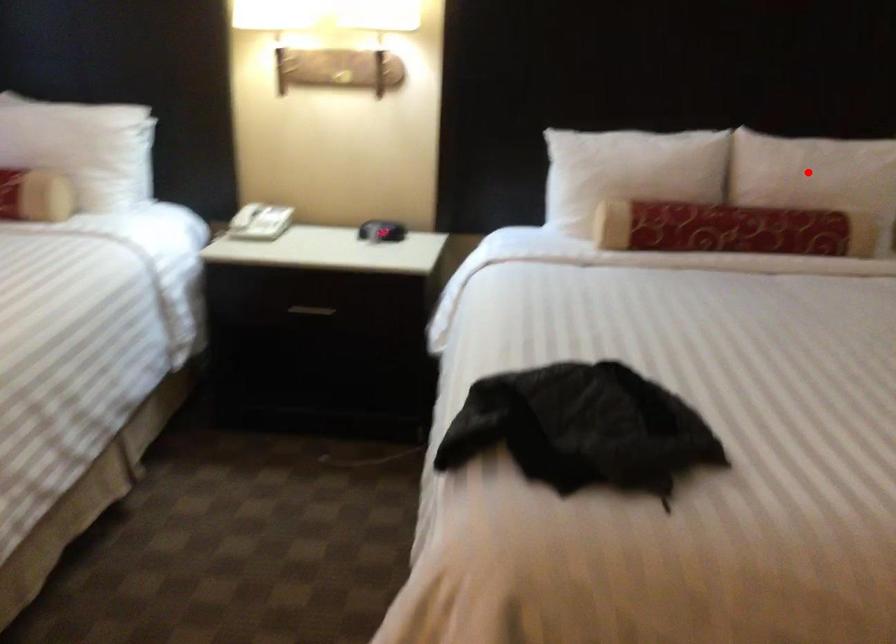
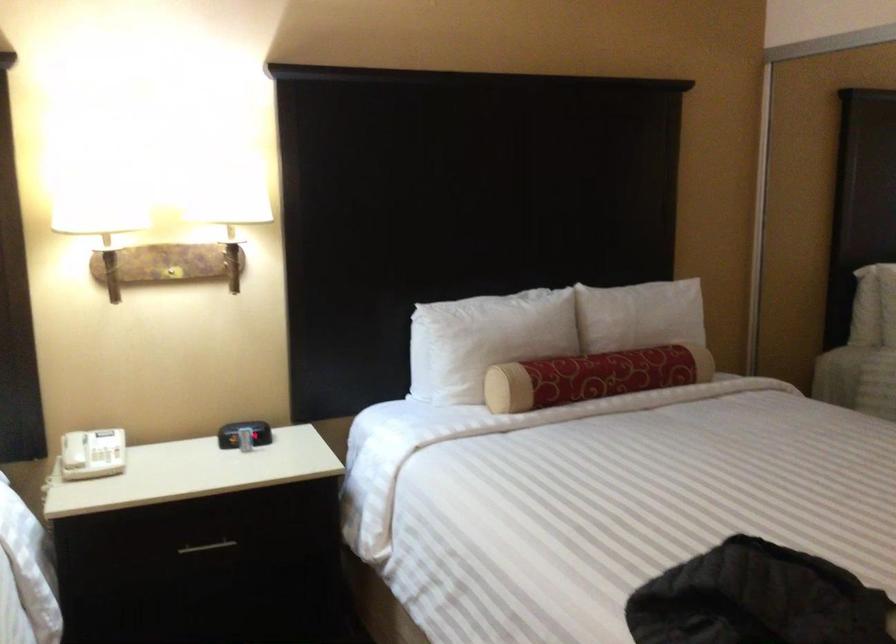
Question: I am providing you with two images of the same scene from different viewpoints. Image1 has a red point marked. In image2, the corresponding 3D location appears at what relative position? Reply with the corresponding letter.

Choices:
 (A) Closer
 (B) Farther

Answer: (B)